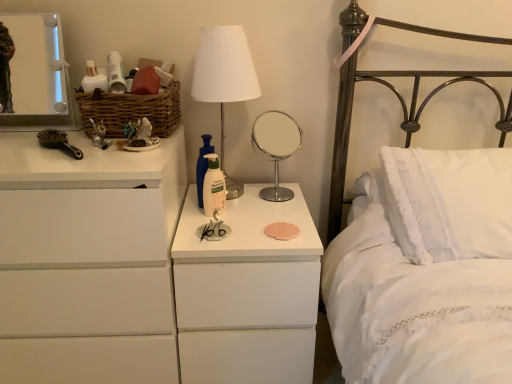
Locate an element on the screen. This screenshot has width=512, height=384. free space to the back side of black plastic brush at left is located at coordinates (75, 139).